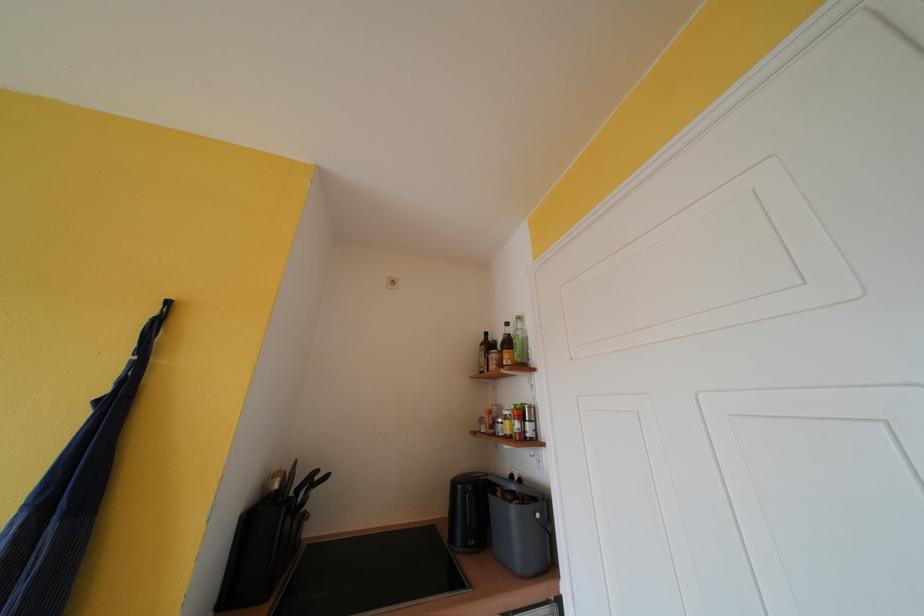
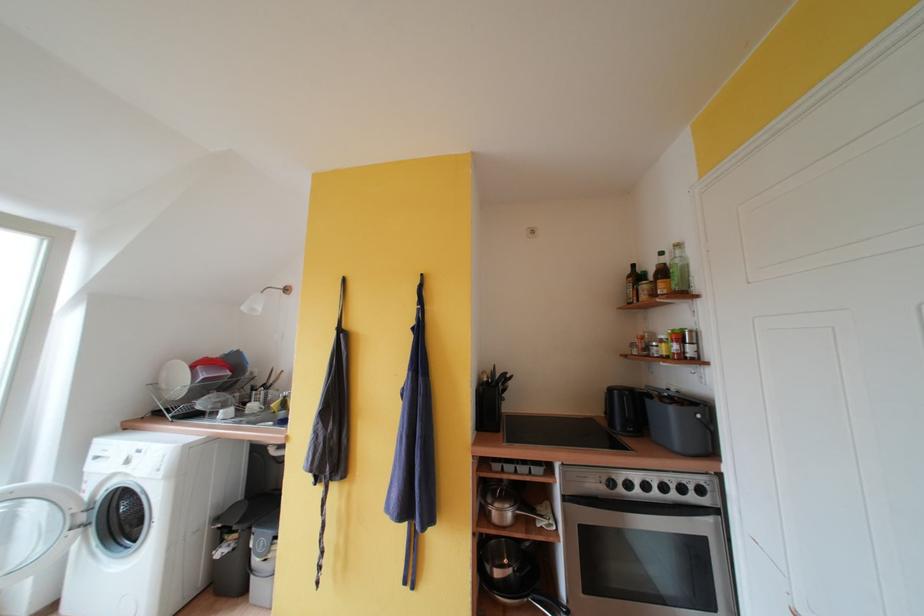
Where in the second image is the point corresponding to [516,334] from the first image?

(671, 262)